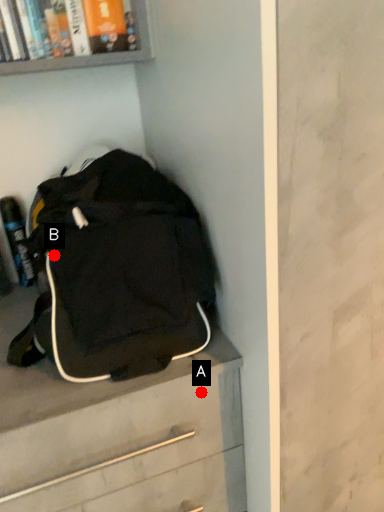
Question: Two points are circled on the image, labeled by A and B beside each circle. Which of the following is the closest to the observer?

Choices:
 (A) A is closer
 (B) B is closer

Answer: (B)